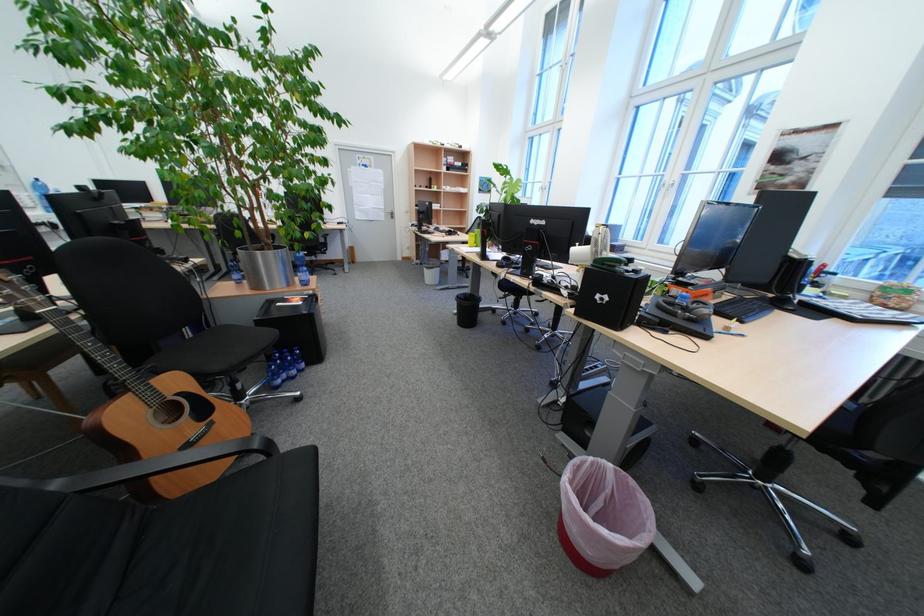
Find where to lift the acoustic guitar. Please return your answer as a coordinate pair (x, y).

(144, 408)